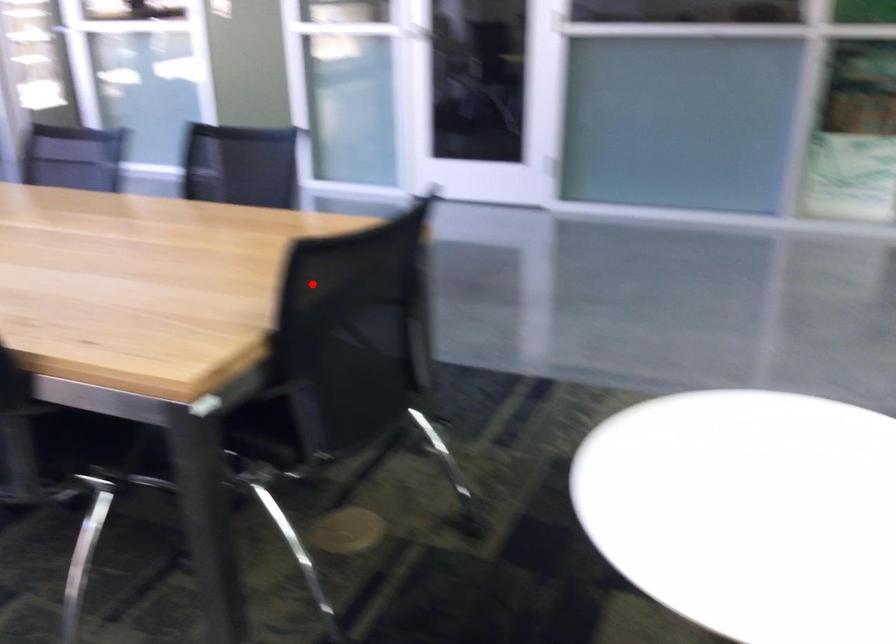
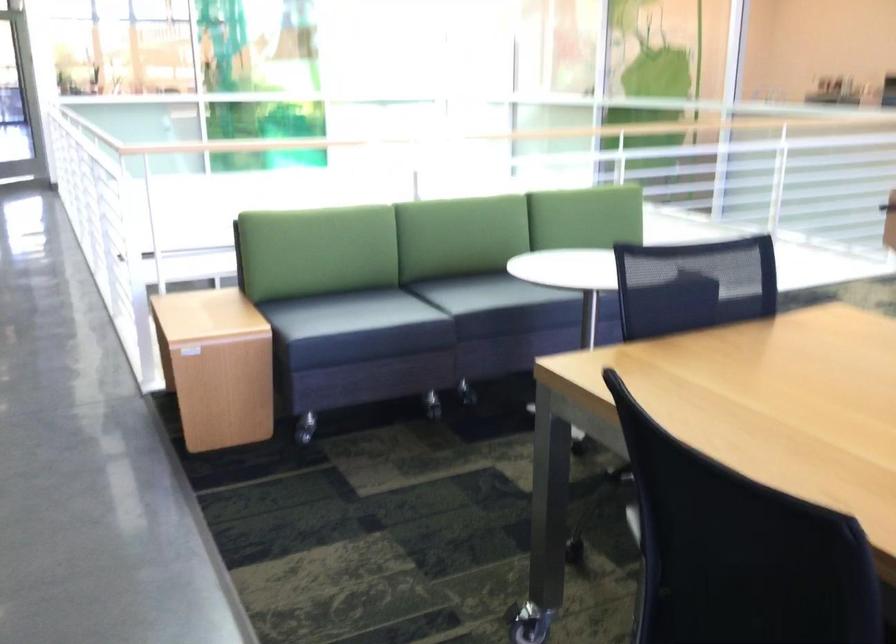
Find the pixel in the second image that matches the highlighted location in the first image.

(695, 275)